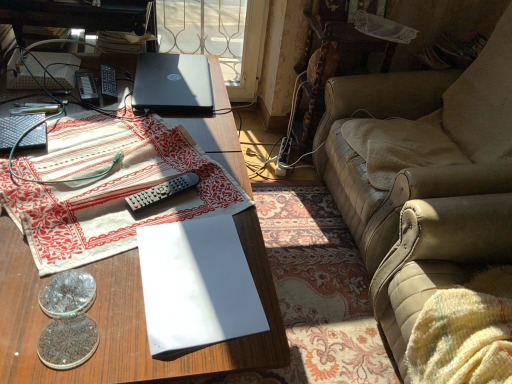
At what (x,y) coordinates should I click in order to perform the action: click on vacant space in between gray plastic remote at center, the third remote control in the top-to-bottom sequence, and white paper at center, marked as the first paperback book in a front-to-back arrangement. Please return your answer as a coordinate pair (x, y). Image resolution: width=512 pixels, height=384 pixels. Looking at the image, I should click on (173, 223).